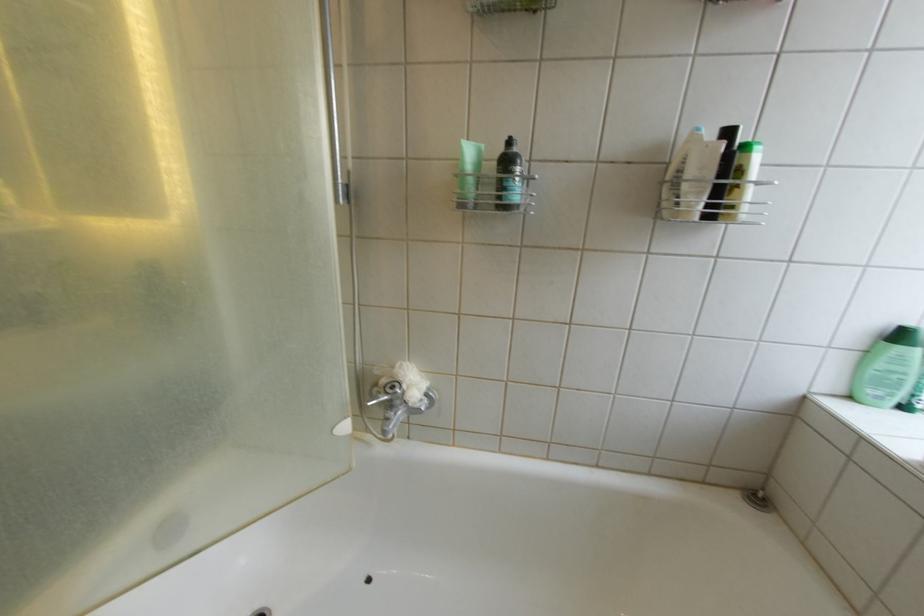
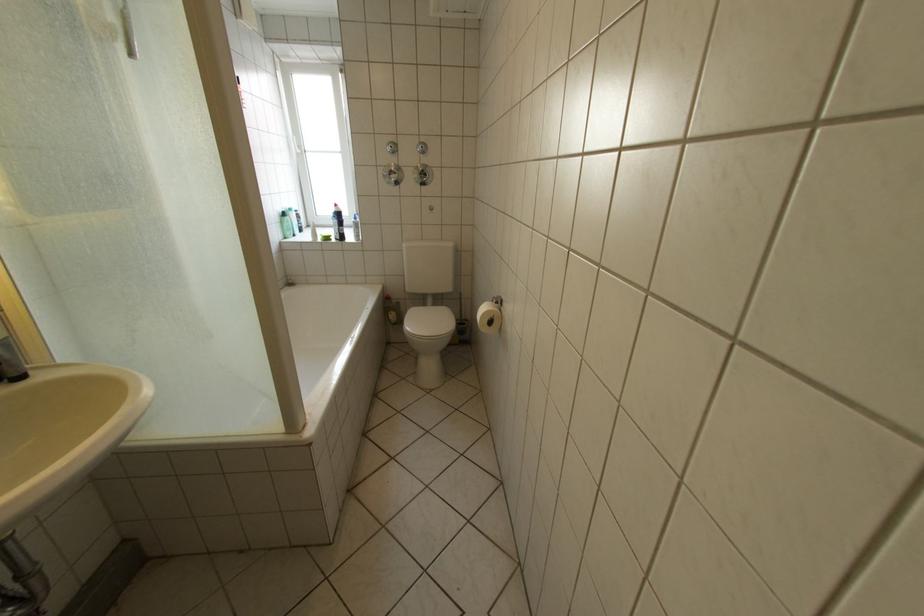
Where in the second image is the point corresponding to (x=880, y=353) from the first image?

(294, 224)